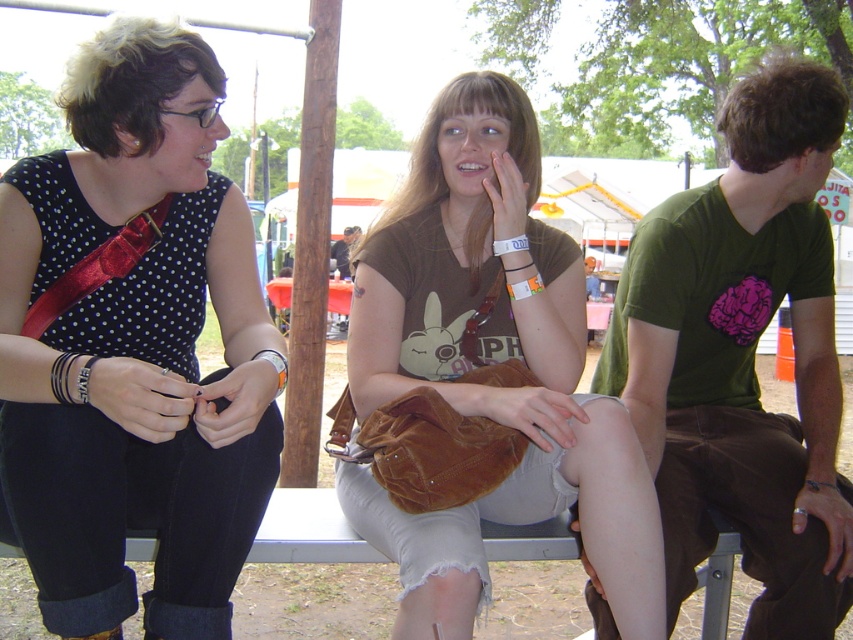
Question: Which of the following is the closest to the observer?

Choices:
 (A) (666, 230)
 (B) (13, 257)
 (C) (450, 256)

Answer: (B)

Question: Does brown suede purse at center have a greater width compared to green cotton shirt at right?

Choices:
 (A) yes
 (B) no

Answer: (B)

Question: From the image, what is the correct spatial relationship of matte black dress at left in relation to green cotton shirt at right?

Choices:
 (A) right
 (B) left

Answer: (B)

Question: Which of the following is the closest to the observer?

Choices:
 (A) (518, 193)
 (B) (134, 586)

Answer: (B)

Question: Is matte black dress at left closer to camera compared to green cotton shirt at right?

Choices:
 (A) no
 (B) yes

Answer: (B)

Question: Which point is closer to the camera?

Choices:
 (A) matte black dress at left
 (B) brown suede purse at center

Answer: (A)